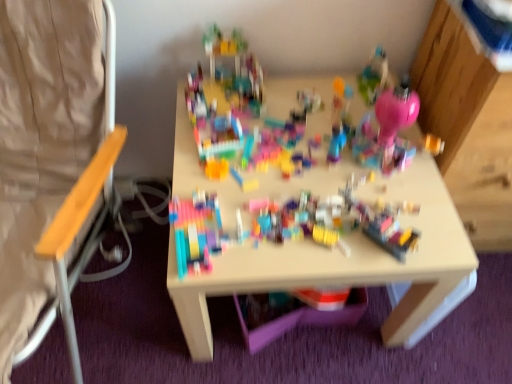
Locate an element on the screen. vacant space to the left of translucent plastic container at center, the 2th toy in the front-to-back sequence is located at coordinates (306, 227).